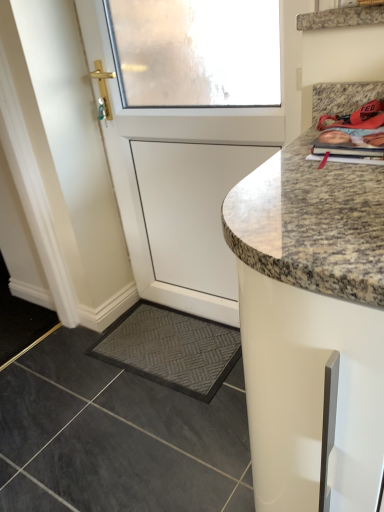
I want to click on free space above dark gray textured mat at lower left (from a real-world perspective), so coord(177,339).